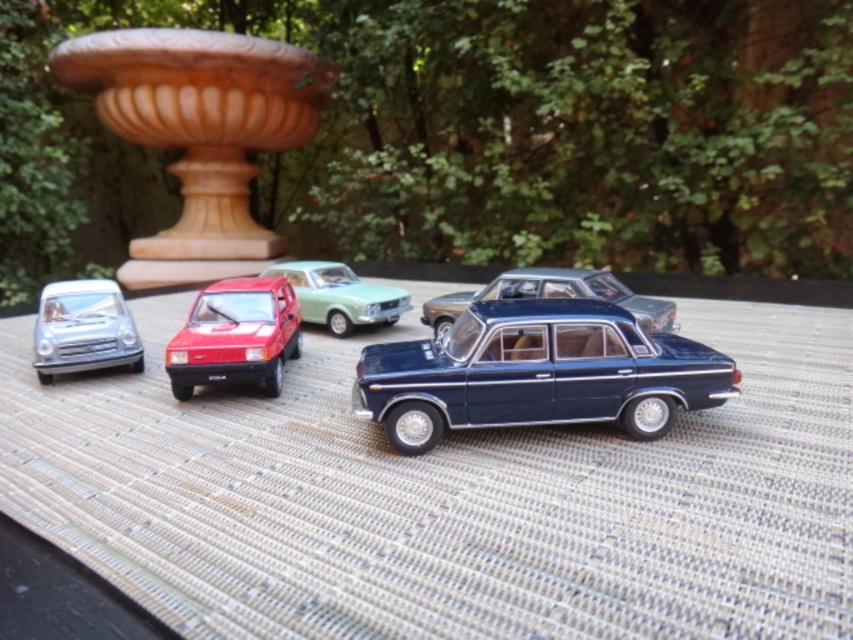
You are a collector arranging miniature cars on a display mat. You have a shiny red car at center and a glossy blue sedan at center. Which car is positioned to the left of the other?

The shiny red car at center is to the left of the glossy blue sedan at center.

Based on the photo, based on the scene description, which object is located at the coordinates point (537, 372)?

The shiny blue sedan at center is located at point (537, 372).

You are a curator arranging miniature cars on a display mat. You have a shiny blue sedan at center. Where should you place a new car so that it aligns with the existing arrangement? Use the coordinates from the scene description to determine the best position.

The shiny blue sedan at center is positioned at coordinates point (x=537, y=372). To align with the existing arrangement, place the new car near these coordinates, ensuring it maintains the semi circular display.